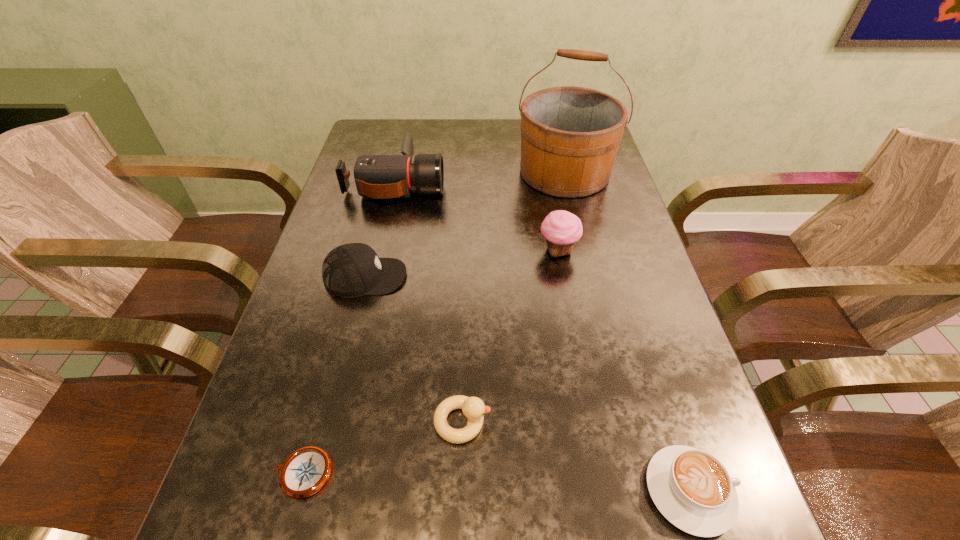
Image resolution: width=960 pixels, height=540 pixels. Find the location of `free space that satisfies the following two spatial constraints: 1. on the lens of the cupcake; 2. on the right side of the camcorder`. free space that satisfies the following two spatial constraints: 1. on the lens of the cupcake; 2. on the right side of the camcorder is located at coordinates (380, 251).